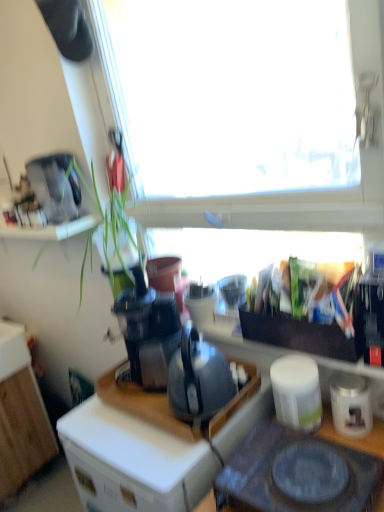
Question: Considering their positions, is black glass gas stove at lower center located in front of or behind satin silver coffee maker at upper left, placed as the fourth appliance when sorted from bottom to top?

Choices:
 (A) behind
 (B) front

Answer: (B)

Question: In the image, is black glass gas stove at lower center on the left side or the right side of satin silver coffee maker at upper left, the 4th appliance viewed from the right?

Choices:
 (A) right
 (B) left

Answer: (A)

Question: Which of these objects is positioned closest to the matte black desk at center?

Choices:
 (A) white matte container at lower right, the second appliance from the bottom
 (B) translucent plastic blender at center, placed as the 3th appliance when sorted from bottom to top
 (C) white plastic drawer at lower left
 (D) transparent glass window at upper center
 (E) black glass gas stove at lower center

Answer: (C)

Question: Which object is the farthest from the white plastic drawer at lower left?

Choices:
 (A) black glass gas stove at lower center
 (B) matte black desk at center
 (C) black plastic coffee machine at center
 (D) white matte container at lower right, the second appliance from the bottom
 (E) satin silver coffee maker at upper left, placed as the fourth appliance when sorted from bottom to top

Answer: (E)